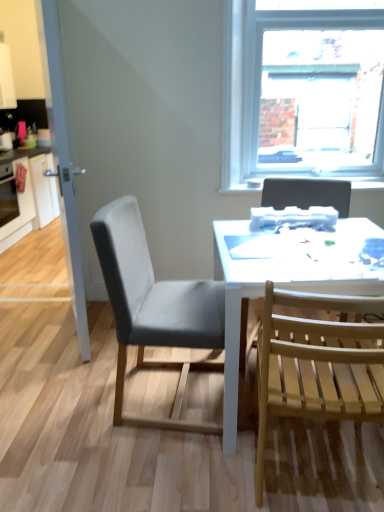
Question: From the image's perspective, is white plastic printer at upper center located above or below light wood slats chair at right, which is the 2th chair from right to left?

Choices:
 (A) below
 (B) above

Answer: (B)

Question: Looking at their shapes, would you say white plastic printer at upper center is wider or thinner than light wood slats chair at right, which is the 2th chair from right to left?

Choices:
 (A) wide
 (B) thin

Answer: (B)

Question: Which is nearer to the white plastic printer at upper center?

Choices:
 (A) white glossy cabinet at left
 (B) gray fabric chair at center, which is the 3th chair from right to left
 (C) clear glass door at left
 (D) clear glass window at upper center
 (E) brushed metal oven at left

Answer: (B)

Question: Which of these objects is positioned closest to the white glossy cabinet at left?

Choices:
 (A) light wood slats chair at right, which is the 2th chair from right to left
 (B) white plastic printer at upper center
 (C) brushed metal oven at left
 (D) matte pink coffee cup at left
 (E) clear glass door at left

Answer: (C)